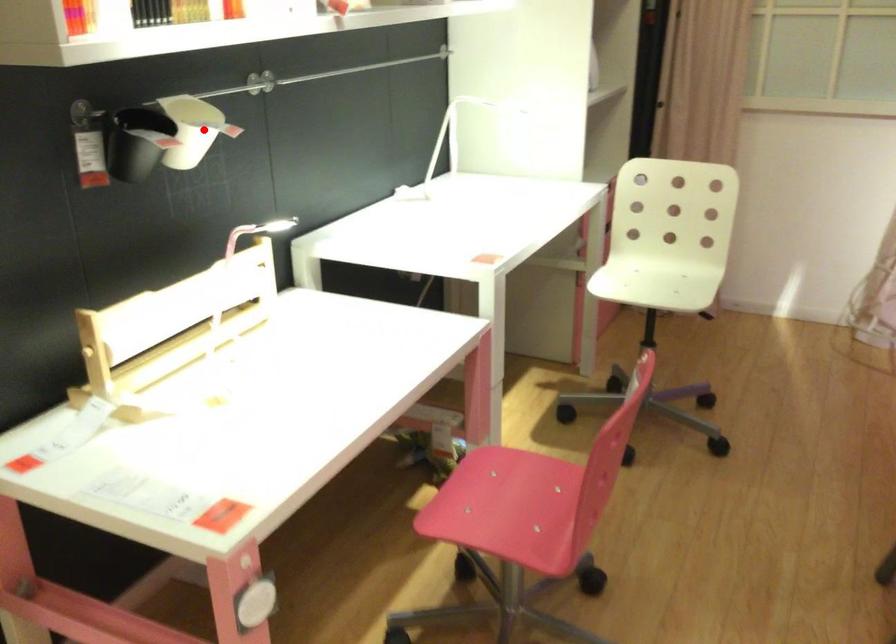
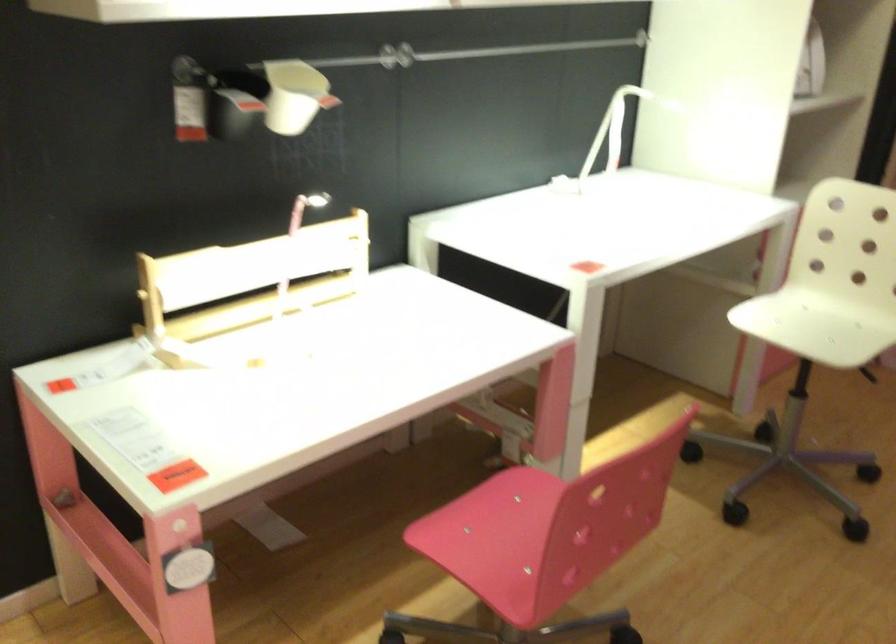
Locate, in the second image, the point that corresponds to the highlighted location in the first image.

(295, 96)